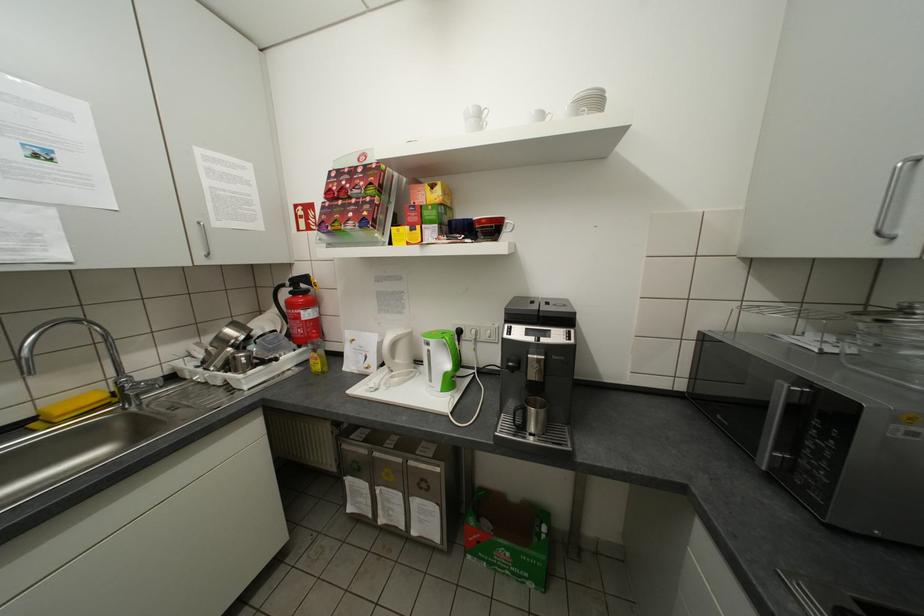
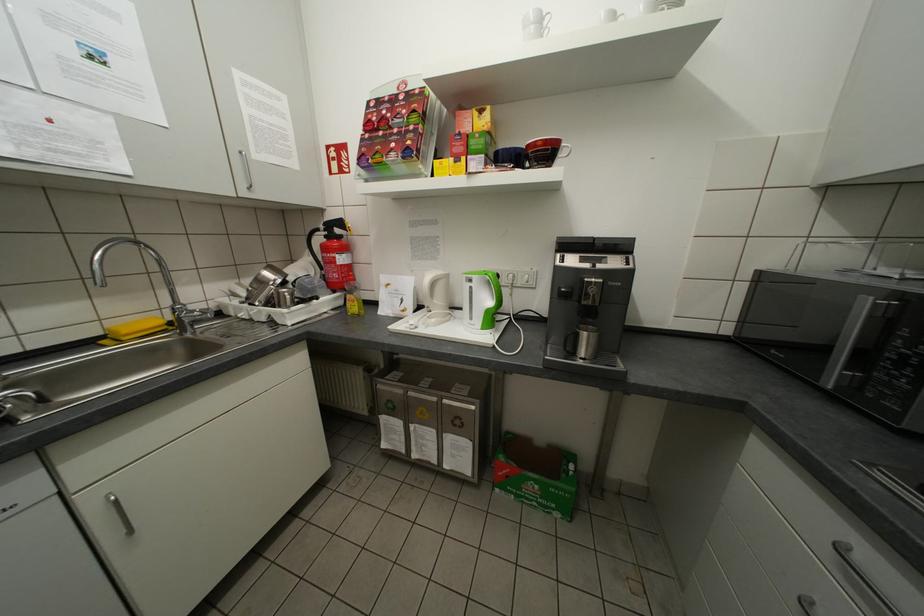
Question: What movement of the cameraman would produce the second image?

Choices:
 (A) Left
 (B) Right
 (C) Forward
 (D) Backward

Answer: (A)